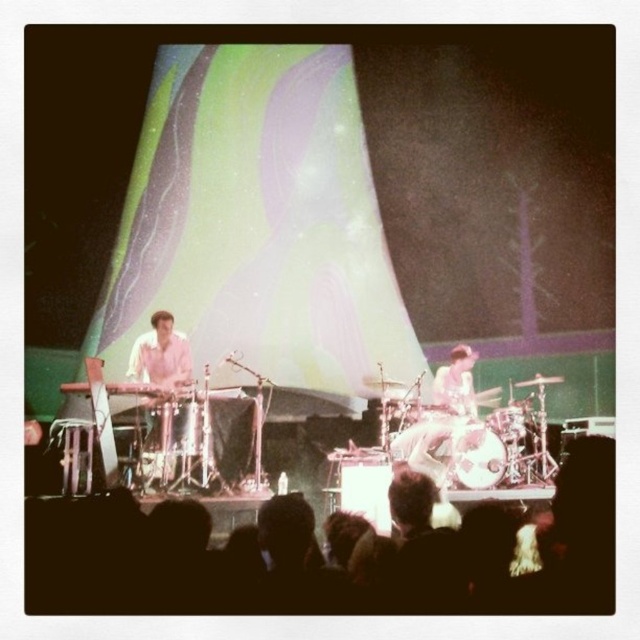
You are a stagehand setting up for a concert. You need to place a new microphone stand between the white wood drum at center and the brushed metal drum at center. According to the stage setup, where should you position the microphone stand relative to these two drums?

The white wood drum at center is located below the brushed metal drum at center, so you should position the microphone stand between them vertically, placing it either above the white wood drum or below the brushed metal drum depending on the required space.

You are a stagehand setting up equipment. You need to place a new microphone stand between the white wood drum at center and the brushed metal drum at center. Which drum should the microphone stand be closer to if it has to be placed exactly halfway between them?

The microphone stand should be closer to the brushed metal drum at center because the white wood drum at center is wider, so placing it halfway would require positioning it nearer to the narrower brushed metal drum at center to maintain equal distance from both edges.

You are a photographer trying to capture the stage setup. You notice two points marked on your camera screen. The first point is at coordinates point [188,442] and the second is at point [504,408]. Which point is closer to you when you are positioned in front of the stage?

Point [188,442] is closer to the viewer than point [504,408].